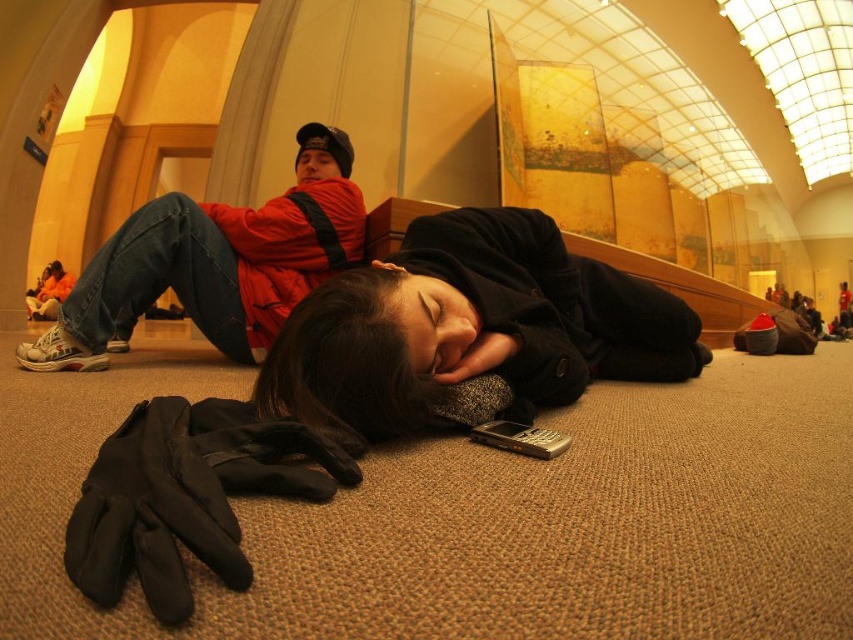
You are a photographer setting up a tripod in the center of the indoor area. You need to ensure that the tripod legs can spread out without hitting any nearby objects. The black woolen coat at center and the matte black cap at upper center are in your path. Based on their sizes, can the tripod legs spread out safely?

The black woolen coat at center might be wider than the matte black cap at upper center, so the tripod legs may not spread out safely if the coat is wider and occupies more space in the path.

You are standing in the museum and want to take a photo of the point at coordinates (279, 396). The camera you have can only focus on objects within 30 inches. Will the point be in focus?

The point at coordinates (279, 396) is 33.01 inches away from the viewer, which is beyond the camera focus range of 30 inches. Therefore, the point will not be in focus.